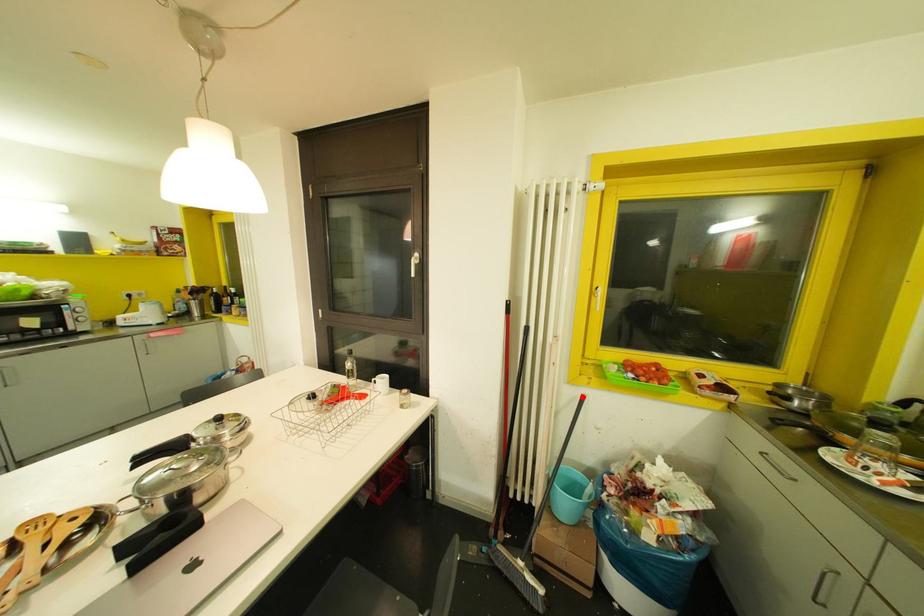
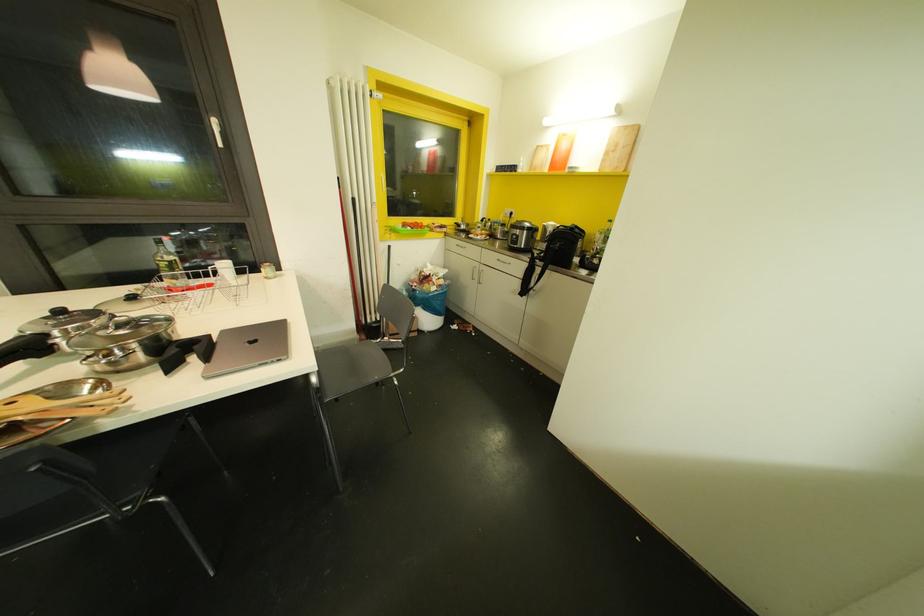
Question: I am providing you with two images of the same scene from different viewpoints. Image1 has a red point marked. In image2, the corresponding 3D location appears at what relative position? Reply with the corresponding letter.

Choices:
 (A) Closer
 (B) Farther

Answer: (A)